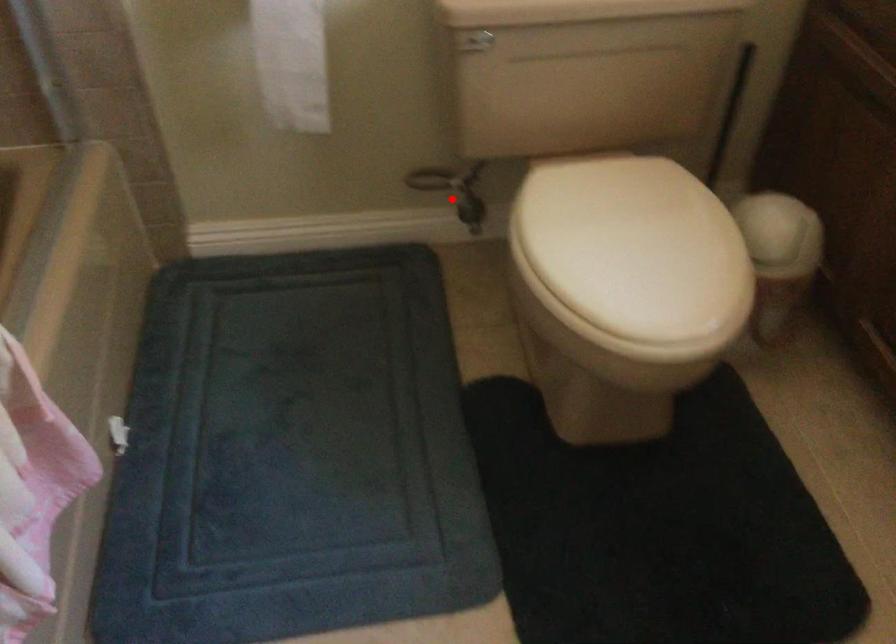
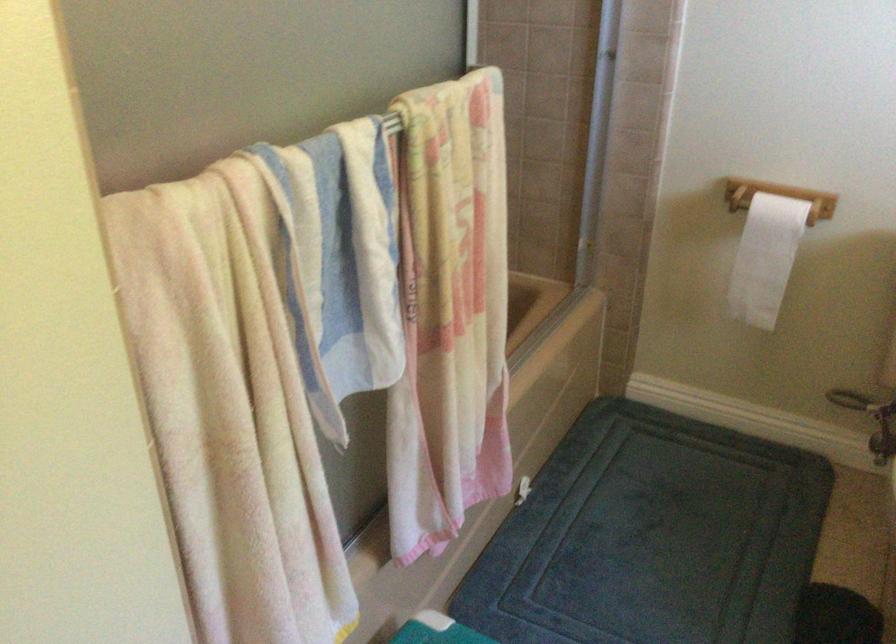
Where in the second image is the point corresponding to the highlighted location from the first image?

(871, 420)